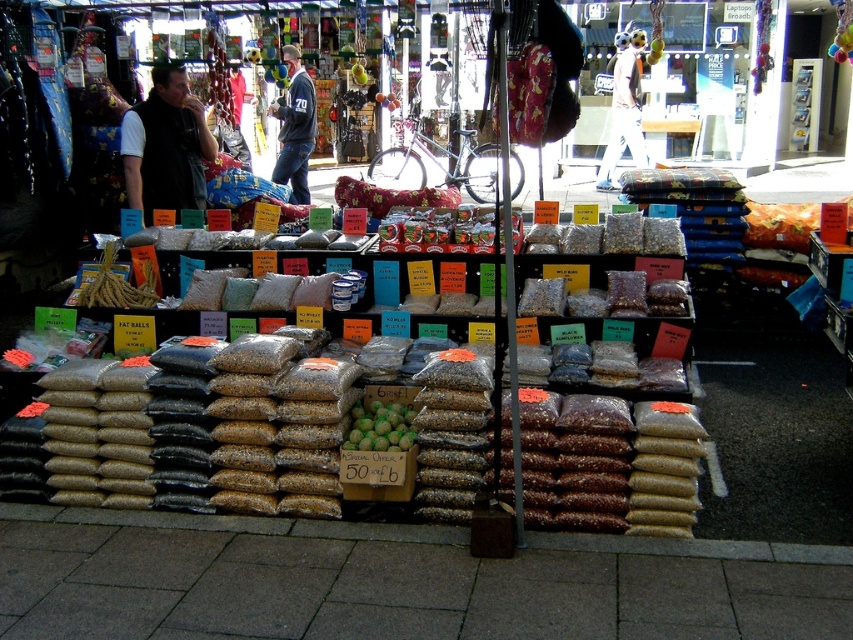
Can you confirm if black vest at left is smaller than white plush teddy bear at upper center?

Correct, black vest at left occupies less space than white plush teddy bear at upper center.

Between black vest at left and white plush teddy bear at upper center, which one appears on the right side from the viewer's perspective?

white plush teddy bear at upper center

Does point (213, 157) lie in front of point (621, 140)?

Yes.

This screenshot has width=853, height=640. I want to click on black vest at left, so click(165, 145).

Does white plush teddy bear at upper center have a smaller size compared to dark blue jersey at center?

Yes.

At what (x,y) coordinates should I click in order to perform the action: click on white plush teddy bear at upper center. Please return your answer as a coordinate pair (x, y). Looking at the image, I should click on (624, 106).

This screenshot has height=640, width=853. Identify the location of white plush teddy bear at upper center. (624, 106).

Does dark blue jersey at center appear under green matte fruit at center?

No, dark blue jersey at center is not below green matte fruit at center.

Who is taller, dark blue jersey at center or green matte fruit at center?

With more height is dark blue jersey at center.

Find the location of a particular element. The height and width of the screenshot is (640, 853). dark blue jersey at center is located at coordinates (294, 128).

At what (x,y) coordinates should I click in order to perform the action: click on dark blue jersey at center. Please return your answer as a coordinate pair (x, y). The width and height of the screenshot is (853, 640). Looking at the image, I should click on click(x=294, y=128).